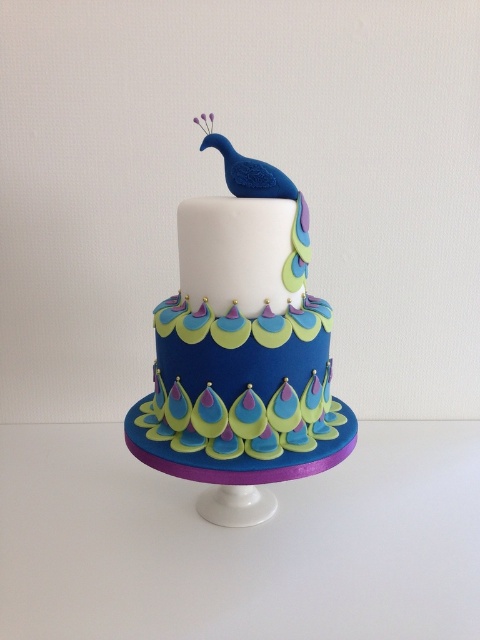
You are a baker who needs to ensure the cake tiers are properly balanced. The matte blue peacock at center and the blue glossy peacock at top are both on the cake. Which peacock has a wider base to help stabilize the top tier?

The matte blue peacock at center has a larger width than the blue glossy peacock at top, so it provides a wider base for stabilization.